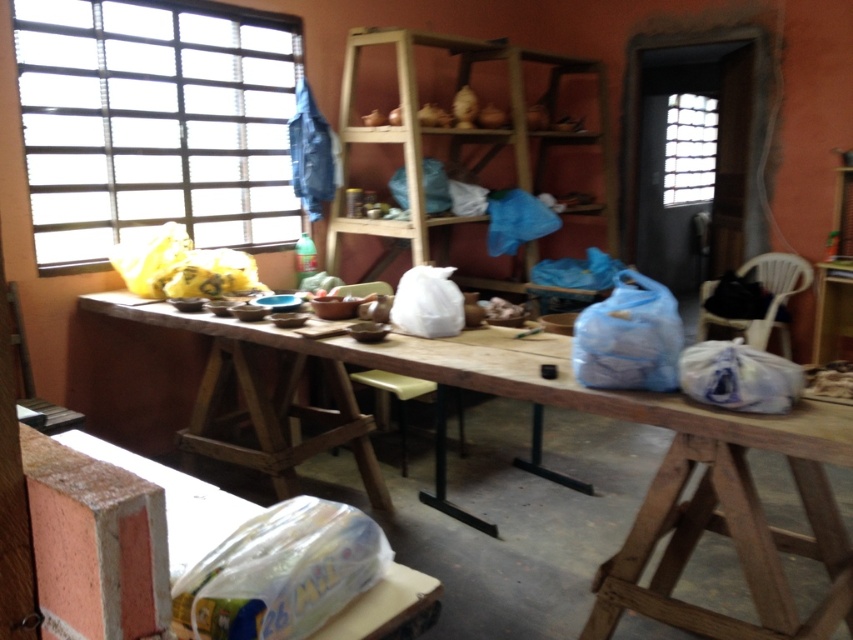
Does wooden shelves at center appear over translucent glass window at upper right?

Incorrect, wooden shelves at center is not positioned above translucent glass window at upper right.

Between point (489, 147) and point (708, 168), which one is positioned behind?

The point (708, 168) is more distant.

What do you see at coordinates (461, 138) in the screenshot?
I see `wooden shelves at center` at bounding box center [461, 138].

The height and width of the screenshot is (640, 853). What are the coordinates of `wooden shelves at center` in the screenshot? It's located at (461, 138).

Does transparent plastic window at upper left appear on the left side of wooden shelves at center?

Indeed, transparent plastic window at upper left is positioned on the left side of wooden shelves at center.

Which is in front, point (265, 218) or point (492, 278)?

Point (265, 218)

Identify the location of transparent plastic window at upper left. (154, 124).

Does wooden shelves at center lie behind blue plastic bag at right?

Yes.

Does wooden shelves at center come in front of blue plastic bag at right?

That is False.

Who is more distant from viewer, (x=387, y=132) or (x=631, y=272)?

The point (x=387, y=132) is behind.

Locate an element on the screen. Image resolution: width=853 pixels, height=640 pixels. wooden shelves at center is located at coordinates (461, 138).